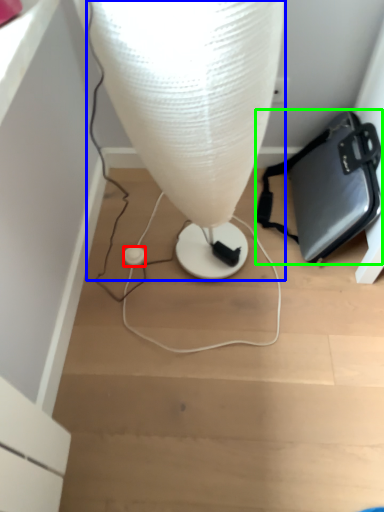
Question: Considering the real-world distances, which object is farthest from earphone (highlighted by a red box)? lamp (highlighted by a blue box) or handbag (highlighted by a green box)?

Choices:
 (A) lamp
 (B) handbag

Answer: (B)